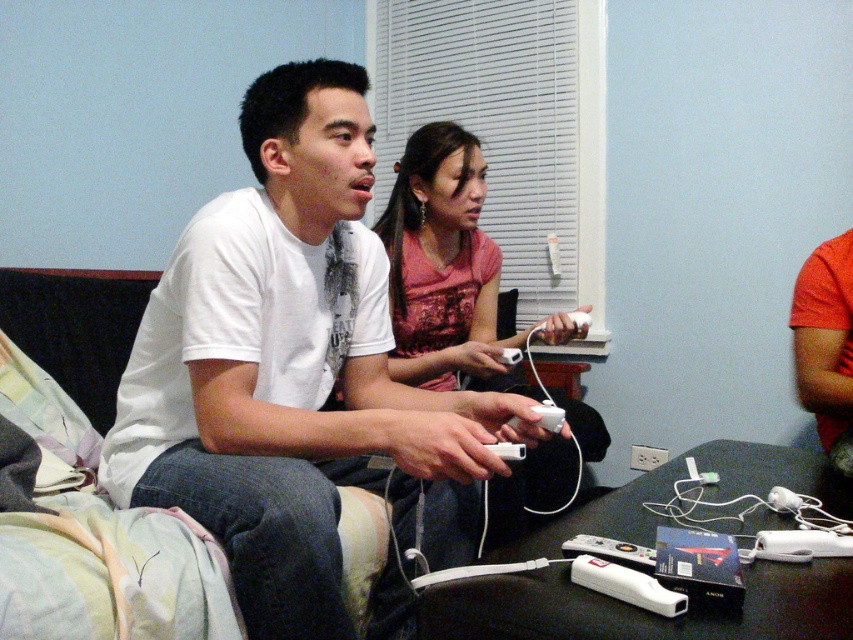
Who is more forward, (401, 492) or (444, 298)?

Point (401, 492) is more forward.

Does white matte shirt at center appear over matte pink shirt at center?

Incorrect, white matte shirt at center is not positioned above matte pink shirt at center.

Between point (247, 440) and point (401, 250), which one is positioned in front?

Positioned in front is point (247, 440).

Where is `white matte shirt at center`? This screenshot has height=640, width=853. white matte shirt at center is located at coordinates (293, 371).

Does white matte shirt at center have a greater height compared to white matte wii remote at lower center?

Yes, white matte shirt at center is taller than white matte wii remote at lower center.

Measure the distance between white matte shirt at center and camera.

1.03 meters

At what (x,y) coordinates should I click in order to perform the action: click on white matte shirt at center. Please return your answer as a coordinate pair (x, y). The width and height of the screenshot is (853, 640). Looking at the image, I should click on (293, 371).

Is white matte shirt at center thinner than white plastic remote at center?

In fact, white matte shirt at center might be wider than white plastic remote at center.

Is point (399, 497) closer to camera compared to point (654, 554)?

No, it is not.

Which is in front, point (164, 292) or point (567, 545)?

Positioned in front is point (567, 545).

Where is `white matte shirt at center`? The image size is (853, 640). white matte shirt at center is located at coordinates (293, 371).